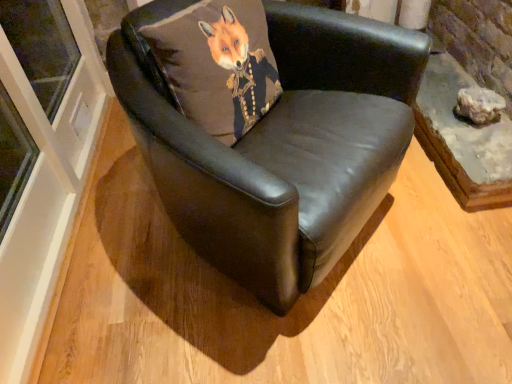
Question: From their relative heights in the image, would you say matte gray rock at right is taller or shorter than matte brown cushion at center?

Choices:
 (A) tall
 (B) short

Answer: (B)

Question: Is matte gray rock at right in front of or behind matte brown cushion at center in the image?

Choices:
 (A) behind
 (B) front

Answer: (A)

Question: Estimate the real-world distances between objects in this image. Which object is closer to the matte brown cushion at center?

Choices:
 (A) black leather chair at center
 (B) matte gray rock at right

Answer: (A)

Question: Estimate the real-world distances between objects in this image. Which object is closer to the matte gray rock at right?

Choices:
 (A) matte brown cushion at center
 (B) black leather chair at center

Answer: (B)